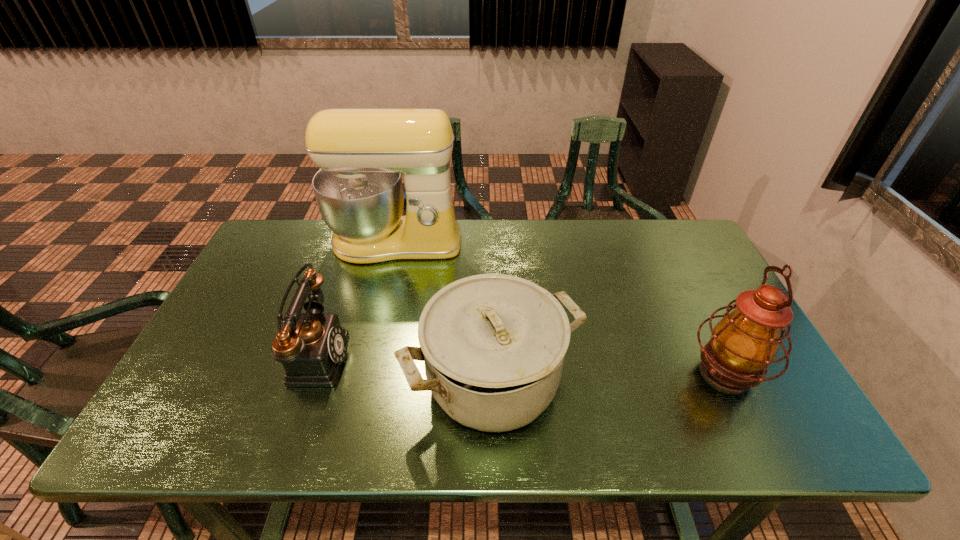
At what (x,y) coordinates should I click in order to perform the action: click on free space that satisfies the following two spatial constraints: 1. on the side of the farthest object with the control knob; 2. on the front of the telephone at the rotary dial. Please return your answer as a coordinate pair (x, y). The image size is (960, 540). Looking at the image, I should click on (370, 355).

The image size is (960, 540). Find the location of `free spot that satisfies the following two spatial constraints: 1. on the back side of the rightmost object; 2. on the right side of the saucepan`. free spot that satisfies the following two spatial constraints: 1. on the back side of the rightmost object; 2. on the right side of the saucepan is located at coordinates (492, 373).

At what (x,y) coordinates should I click in order to perform the action: click on blank area in the image that satisfies the following two spatial constraints: 1. on the side of the farthest object with the control knob; 2. on the front of the telephone at the rotary dial. Please return your answer as a coordinate pair (x, y). Image resolution: width=960 pixels, height=540 pixels. Looking at the image, I should click on (370, 355).

Locate an element on the screen. The width and height of the screenshot is (960, 540). free space that satisfies the following two spatial constraints: 1. on the front of the saucepan at the rotary dial; 2. on the right side of the telephone is located at coordinates (305, 380).

Find the location of a particular element. vacant space that satisfies the following two spatial constraints: 1. on the front of the rightmost object at the rotary dial; 2. on the right side of the telephone is located at coordinates (308, 373).